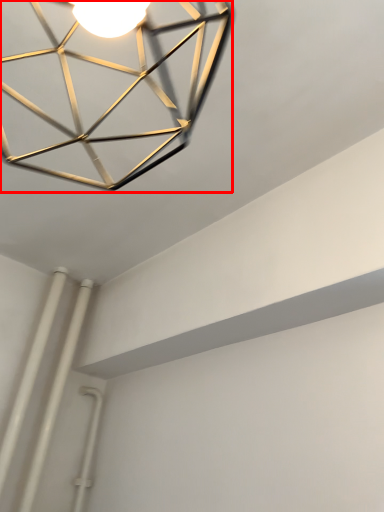
Question: From the image's perspective, considering the relative positions of lamp (annotated by the red box) and pipe in the image provided, where is lamp (annotated by the red box) located with respect to the staircase?

Choices:
 (A) above
 (B) below

Answer: (A)